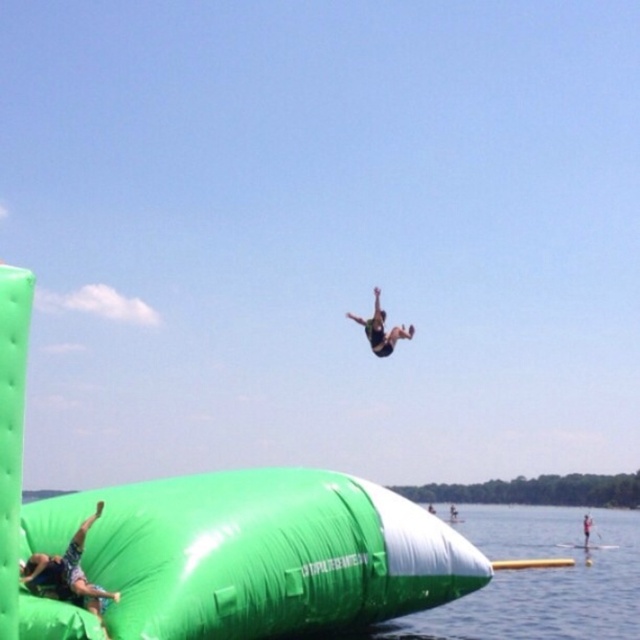
Is point (54, 570) more distant than point (582, 532)?

No, it is not.

Can you confirm if camouflage fabric person at lower left is thinner than reddish-brown wooden paddleboard at center?

Yes.

I want to click on camouflage fabric person at lower left, so click(67, 573).

Between camouflage fabric person at lower left and smooth white surfboard at center, which one is positioned higher?

camouflage fabric person at lower left is higher up.

Does camouflage fabric person at lower left have a lesser height compared to smooth white surfboard at center?

Yes.

I want to click on camouflage fabric person at lower left, so 67,573.

In order to click on camouflage fabric person at lower left in this screenshot , I will do `click(67, 573)`.

Which is above, black fabric person at center or reddish-brown wooden paddleboard at center?

black fabric person at center

Is black fabric person at center to the right of reddish-brown wooden paddleboard at center from the viewer's perspective?

Incorrect, black fabric person at center is not on the right side of reddish-brown wooden paddleboard at center.

Does point (392, 330) come farther from viewer compared to point (586, 532)?

No.

I want to click on black fabric person at center, so click(x=380, y=330).